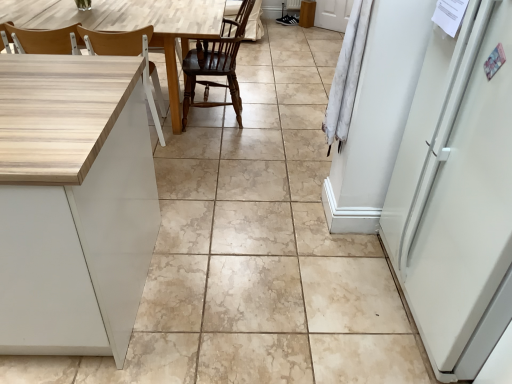
Question: Is wooden at left, the 1th chair viewed from the left, in front of or behind dark wood chair at center, which is the first chair from right to left, in the image?

Choices:
 (A) behind
 (B) front

Answer: (B)

Question: From a real-world perspective, is wooden at left, which appears as the second chair when viewed from the right, above or below dark wood chair at center, the second chair from the left?

Choices:
 (A) below
 (B) above

Answer: (A)

Question: Estimate the real-world distances between objects in this image. Which object is closer to the light wood table at left?

Choices:
 (A) dark wood chair at center, the second chair from the left
 (B) wooden at left, the 1th chair viewed from the left

Answer: (B)

Question: Which is nearer to the light wood table at left?

Choices:
 (A) dark wood chair at center, the second chair from the left
 (B) wooden at left, the 1th chair viewed from the left

Answer: (B)